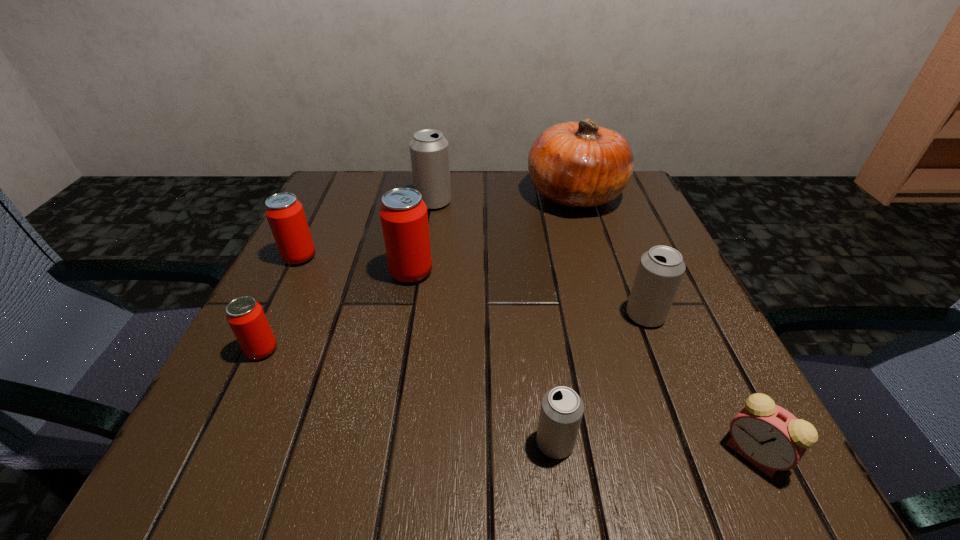
Locate which white beer can is the third closest to the pumpkin. Please provide its 2D coordinates. Your answer should be formatted as a tuple, i.e. [(x, y)], where the tuple contains the x and y coordinates of a point satisfying the conditions above.

[(561, 412)]

Point out which red beer can is positioned as the nearest to the second biggest red beer can. Please provide its 2D coordinates. Your answer should be formatted as a tuple, i.e. [(x, y)], where the tuple contains the x and y coordinates of a point satisfying the conditions above.

[(404, 218)]

What are the coordinates of `red beer can that is the closest to the pumpkin` in the screenshot? It's located at (404, 218).

You are a GUI agent. You are given a task and a screenshot of the screen. Output one action in this format:
    pyautogui.click(x=<x>, y=<y>)
    Task: Click on the vacant region that satisfies the following two spatial constraints: 1. on the front side of the second biggest red beer can; 2. on the left side of the second farthest white beer can
    This screenshot has width=960, height=540.
    Given the screenshot: What is the action you would take?
    pyautogui.click(x=271, y=315)

Where is `vacant area that satisfies the following two spatial constraints: 1. on the back side of the farthest beer can; 2. on the left side of the second smallest red beer can`? vacant area that satisfies the following two spatial constraints: 1. on the back side of the farthest beer can; 2. on the left side of the second smallest red beer can is located at coordinates (326, 202).